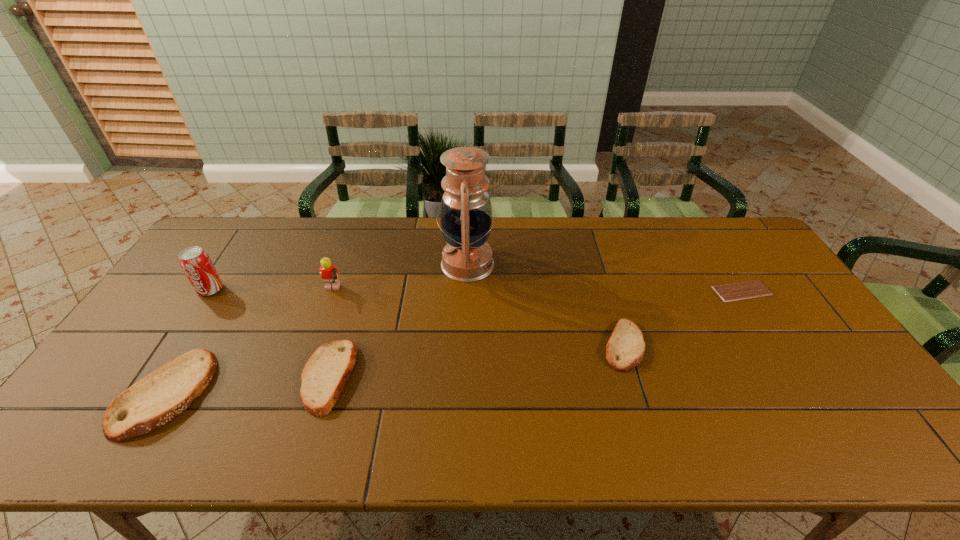
The height and width of the screenshot is (540, 960). What are the coordinates of `the fourth shortest object` in the screenshot? It's located at (x=163, y=394).

Locate an element on the screen. This screenshot has width=960, height=540. the tallest pita bread is located at coordinates (163, 394).

Image resolution: width=960 pixels, height=540 pixels. What are the coordinates of `the second shortest pita bread` in the screenshot? It's located at (324, 376).

Find the location of `the fifth tallest object`. the fifth tallest object is located at coordinates (324, 376).

Find the location of a particular element. This screenshot has width=960, height=540. the sixth tallest object is located at coordinates (625, 348).

At what (x,y) coordinates should I click in order to perform the action: click on the shortest pita bread. Please return your answer as a coordinate pair (x, y). Looking at the image, I should click on (625, 348).

Find the location of a particular element. The width and height of the screenshot is (960, 540). oil lamp is located at coordinates (465, 213).

Identify the location of the tallest object. The height and width of the screenshot is (540, 960). (465, 213).

The height and width of the screenshot is (540, 960). I want to click on chocolate bar, so click(x=751, y=289).

Where is `the rightmost object`? The image size is (960, 540). the rightmost object is located at coordinates (751, 289).